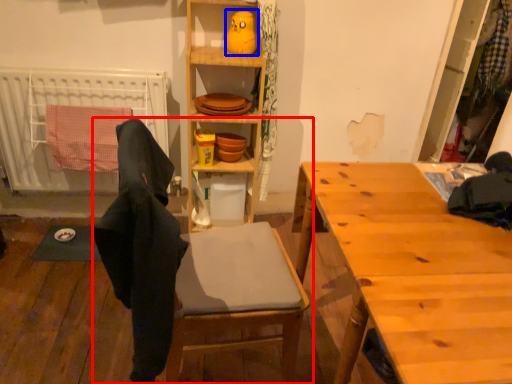
Question: Which of the following is the farthest to the observer, chair (highlighted by a red box) or toy (highlighted by a blue box)?

Choices:
 (A) chair
 (B) toy

Answer: (B)